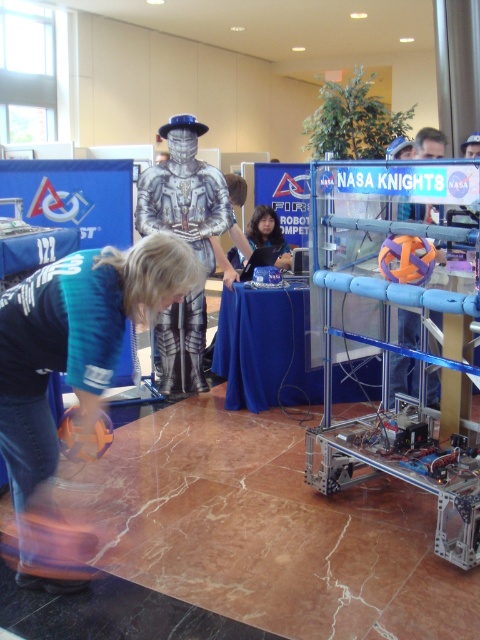
Is silver metallic armor at center further to the viewer compared to smooth black hair at center?

No, it is in front of smooth black hair at center.

Can you confirm if silver metallic armor at center is positioned below smooth black hair at center?

Indeed, silver metallic armor at center is positioned under smooth black hair at center.

Which is in front, point (171, 316) or point (271, 234)?

Point (171, 316)

At what (x,y) coordinates should I click in order to perform the action: click on silver metallic armor at center. Please return your answer as a coordinate pair (x, y). The image size is (480, 640). Looking at the image, I should click on (184, 193).

Which is more to the right, blue denim jeans at lower left or smooth black hair at center?

smooth black hair at center is more to the right.

Is blue denim jeans at lower left below smooth black hair at center?

Yes.

The width and height of the screenshot is (480, 640). What are the coordinates of `blue denim jeans at lower left` in the screenshot? It's located at (75, 342).

Identify the location of blue denim jeans at lower left. Image resolution: width=480 pixels, height=640 pixels. (75, 342).

Consider the image. Can you confirm if blue denim jeans at lower left is positioned below silver metallic armor at center?

Yes.

Consider the image. Between blue denim jeans at lower left and silver metallic armor at center, which one appears on the right side from the viewer's perspective?

silver metallic armor at center

The image size is (480, 640). Identify the location of blue denim jeans at lower left. (75, 342).